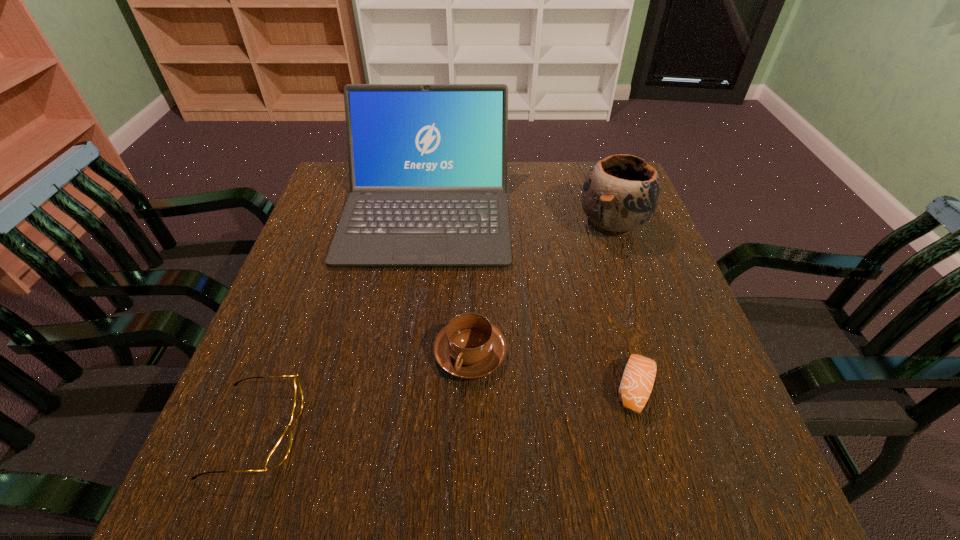
Locate an element on the screen. This screenshot has width=960, height=540. vacant area at the far edge is located at coordinates [516, 167].

Locate an element on the screen. blank space at the near edge of the desktop is located at coordinates (470, 468).

The width and height of the screenshot is (960, 540). What are the coordinates of `vacant space at the left edge of the desktop` in the screenshot? It's located at (283, 287).

The height and width of the screenshot is (540, 960). In the image, there is a desktop. Identify the location of vacant space at the right edge. (628, 255).

Where is `free space between the fourth shortest object and the spectacles`? This screenshot has width=960, height=540. free space between the fourth shortest object and the spectacles is located at coordinates (435, 327).

What are the coordinates of `empty location between the sushi and the third tallest object` in the screenshot? It's located at (553, 371).

This screenshot has height=540, width=960. In order to click on empty space between the laptop computer and the second tallest object in this screenshot , I will do `click(519, 218)`.

This screenshot has width=960, height=540. Find the location of `empty space between the sushi and the spectacles`. empty space between the sushi and the spectacles is located at coordinates pyautogui.click(x=446, y=409).

The height and width of the screenshot is (540, 960). Identify the location of free space between the spectacles and the pottery. (435, 327).

Where is `unoccupied position between the fourth shortest object and the laptop computer`? This screenshot has height=540, width=960. unoccupied position between the fourth shortest object and the laptop computer is located at coordinates (519, 218).